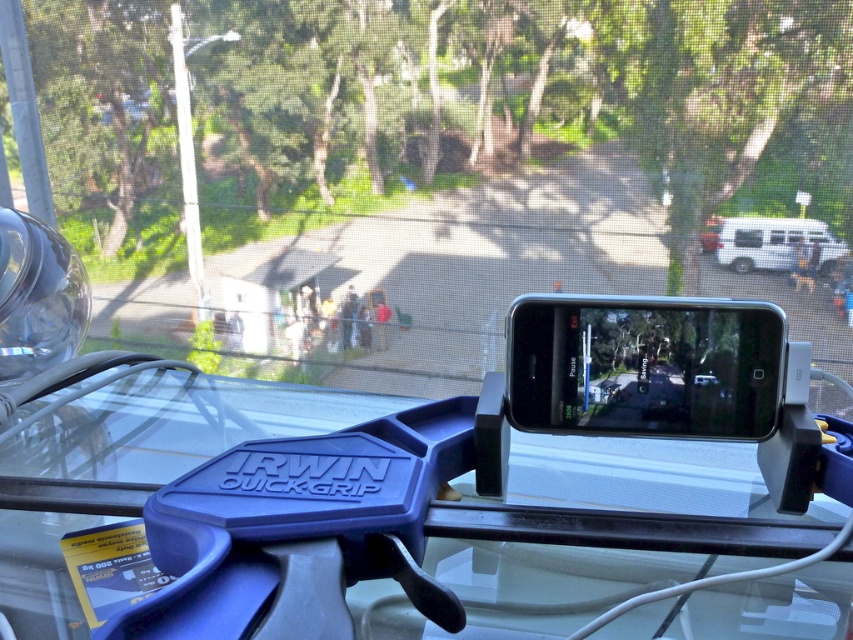
Which of these two, black glossy phone at center or white matte van at right, stands taller?

With more height is black glossy phone at center.

Does point (567, 385) come closer to viewer compared to point (822, 268)?

That is True.

The image size is (853, 640). I want to click on black glossy phone at center, so click(643, 365).

Does blue plastic clamp at center have a lesser height compared to black glossy phone at center?

In fact, blue plastic clamp at center may be taller than black glossy phone at center.

Which is above, blue plastic clamp at center or black glossy phone at center?

black glossy phone at center

Does point (202, 483) come closer to viewer compared to point (674, 397)?

Yes, point (202, 483) is in front of point (674, 397).

At what (x,y) coordinates should I click in order to perform the action: click on blue plastic clamp at center. Please return your answer as a coordinate pair (x, y). Image resolution: width=853 pixels, height=640 pixels. Looking at the image, I should click on (310, 516).

Based on the photo, can you confirm if blue plastic clamp at center is positioned below white matte van at right?

Indeed, blue plastic clamp at center is positioned under white matte van at right.

Which is behind, point (270, 477) or point (782, 230)?

Point (782, 230)

The width and height of the screenshot is (853, 640). Find the location of `blue plastic clamp at center`. blue plastic clamp at center is located at coordinates [310, 516].